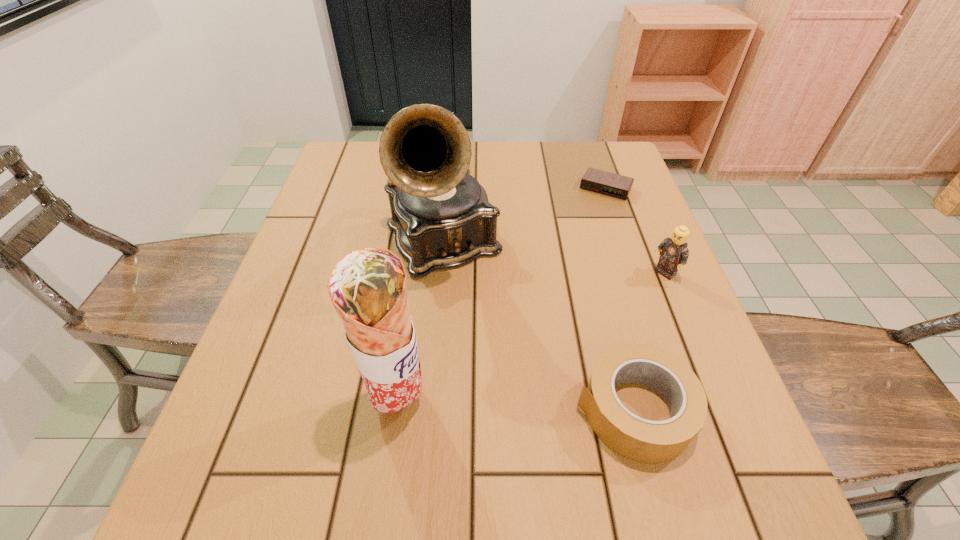
Image resolution: width=960 pixels, height=540 pixels. In order to click on unoccupied position between the second shortest object and the tallest object in this screenshot , I will do `click(539, 326)`.

Where is `free space between the duct tape and the tallest object`? This screenshot has height=540, width=960. free space between the duct tape and the tallest object is located at coordinates (539, 326).

Identify which object is located as the second nearest to the second tallest object. Please provide its 2D coordinates. Your answer should be formatted as a tuple, i.e. [(x, y)], where the tuple contains the x and y coordinates of a point satisfying the conditions above.

[(638, 439)]

Where is `object identified as the closest to the Lego`? object identified as the closest to the Lego is located at coordinates (638, 439).

The height and width of the screenshot is (540, 960). I want to click on free spot that satisfies the following two spatial constraints: 1. on the front side of the tallest object; 2. on the left side of the third shortest object, so click(x=440, y=274).

Locate an element on the screen. free spot that satisfies the following two spatial constraints: 1. on the front side of the duct tape; 2. at the edge of the phonograph record is located at coordinates (428, 410).